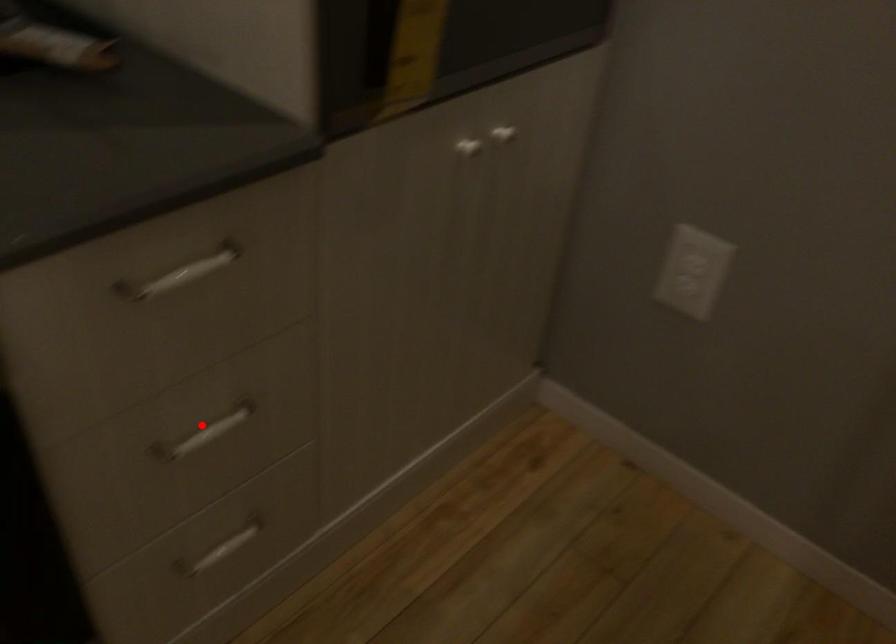
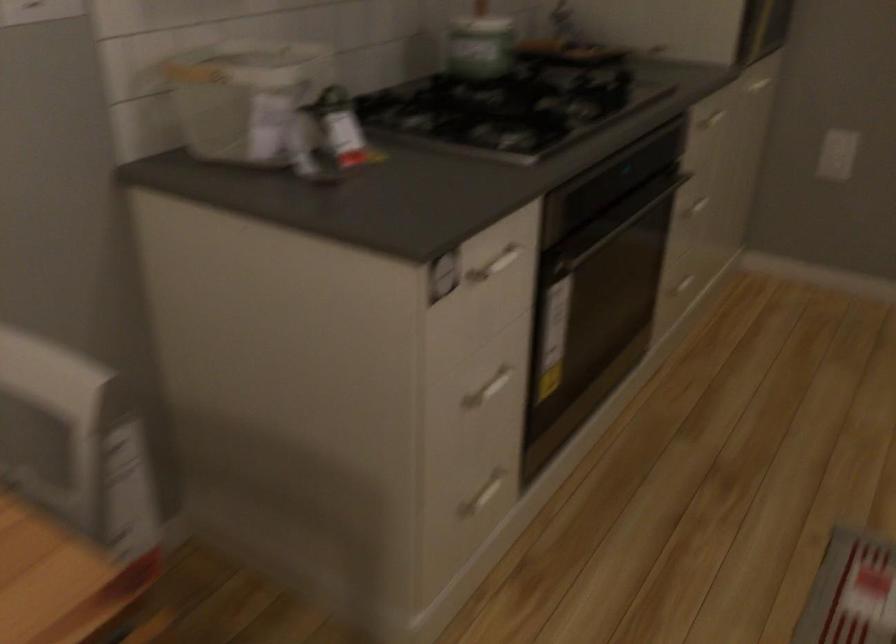
Question: A red point is marked in image1. In image2, is the corresponding 3D point closer to the camera or farther? Reply with the corresponding letter.

Choices:
 (A) The corresponding 3D point is closer.
 (B) The corresponding 3D point is farther.

Answer: (B)